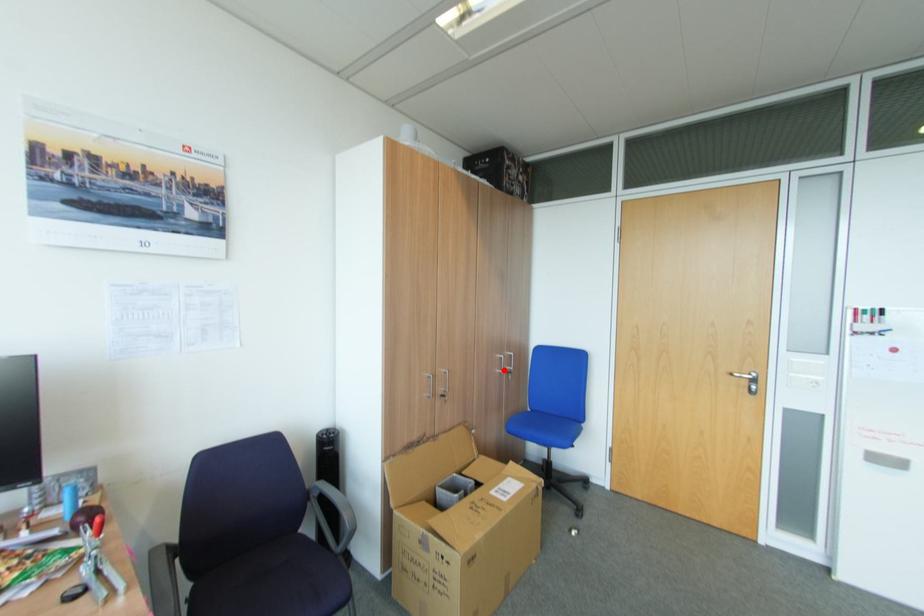
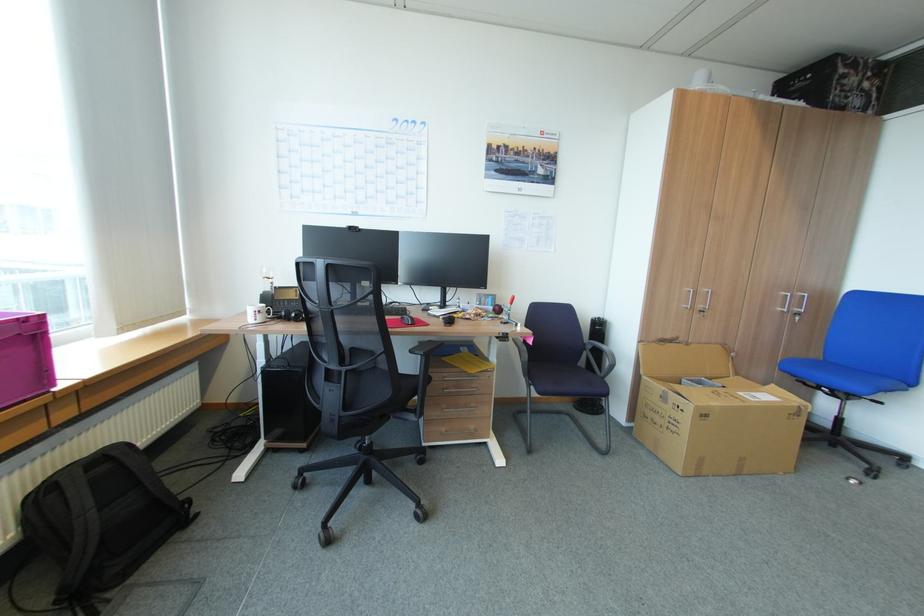
Question: I am providing you with two images of the same scene from different viewpoints. In image1, a red point is highlighted. Considering the same 3D point in image2, which of the following is correct?

Choices:
 (A) It is closer
 (B) It is farther

Answer: (A)